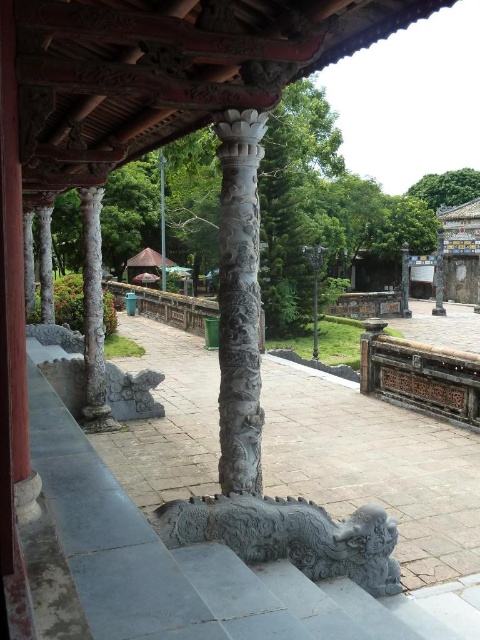
Between carved stone pillar at center and brown wooden canopy at upper center, which one has more height?

With more height is carved stone pillar at center.

Is point (162, 180) in front of point (132, 257)?

Yes, it is.

Image resolution: width=480 pixels, height=640 pixels. I want to click on carved stone pillar at center, so click(x=163, y=221).

Is carved stone column at left wider than slate gray stone column at left?

Incorrect, carved stone column at left's width does not surpass slate gray stone column at left's.

Which is behind, point (40, 218) or point (31, 298)?

Point (31, 298)

Locate an element on the screen. The image size is (480, 640). carved stone column at left is located at coordinates (46, 262).

Is gray stone dragon at lower center in front of brown wooden canopy at upper center?

Yes, it is.

Is point (347, 531) less distant than point (157, 260)?

Yes.

This screenshot has height=640, width=480. What are the coordinates of `gray stone dragon at lower center` in the screenshot? It's located at (288, 536).